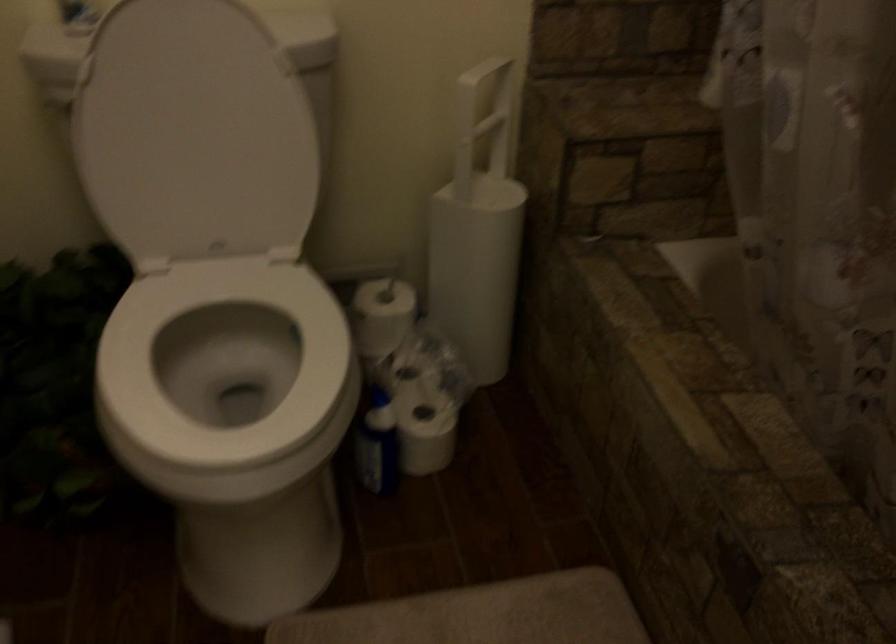
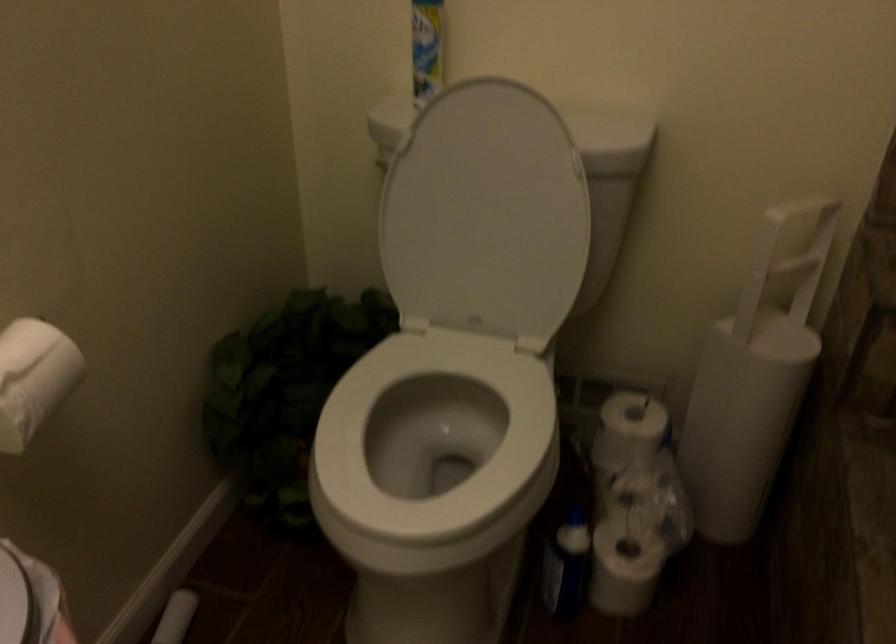
Question: Based on the continuous images, in which direction is the camera rotating? Reply with the corresponding letter.

Choices:
 (A) Left
 (B) Right
 (C) Up
 (D) Down

Answer: (A)